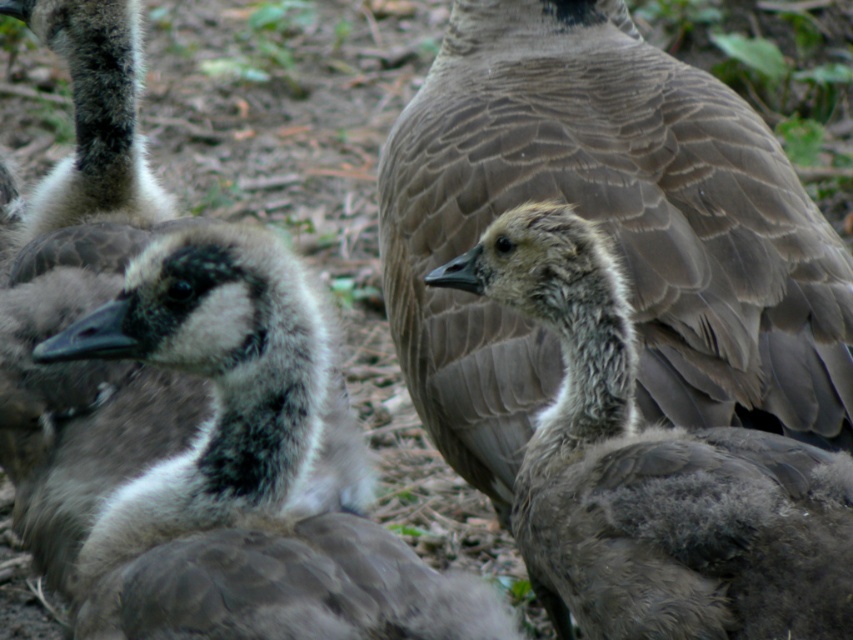
Is dark gray fluffy duckling at left bigger than gray downy duckling at center?

Indeed, dark gray fluffy duckling at left has a larger size compared to gray downy duckling at center.

Is dark gray fluffy duckling at left below gray downy duckling at center?

No, dark gray fluffy duckling at left is not below gray downy duckling at center.

You are a GUI agent. You are given a task and a screenshot of the screen. Output one action in this format:
    pyautogui.click(x=<x>, y=<y>)
    Task: Click on the dark gray fluffy duckling at left
    
    Given the screenshot: What is the action you would take?
    pyautogui.click(x=250, y=470)

Which of these two, gray downy feathers at center or gray downy duckling at center, stands taller?

gray downy feathers at center

Is gray downy feathers at center smaller than gray downy duckling at center?

No.

Is point (688, 336) closer to viewer compared to point (572, 595)?

No.

Where is `gray downy feathers at center`? This screenshot has width=853, height=640. gray downy feathers at center is located at coordinates (608, 234).

Where is `gray downy feathers at center`? This screenshot has height=640, width=853. gray downy feathers at center is located at coordinates (608, 234).

Locate an element on the screen. This screenshot has width=853, height=640. gray downy feathers at center is located at coordinates (608, 234).

You are a GUI agent. You are given a task and a screenshot of the screen. Output one action in this format:
    pyautogui.click(x=<x>, y=<y>)
    Task: Click on the gray downy feathers at center
    Image resolution: width=853 pixels, height=640 pixels.
    Given the screenshot: What is the action you would take?
    pyautogui.click(x=608, y=234)